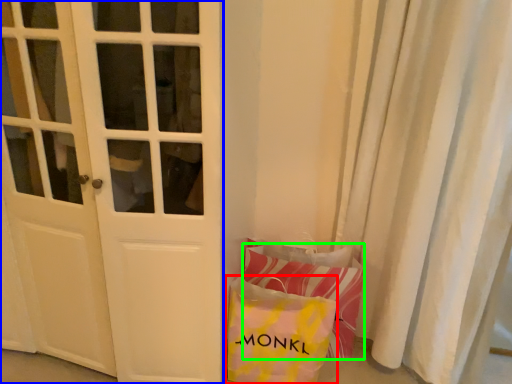
Question: Which object is the closest to the pouch (highlighted by a red box)? Choose among these: door (highlighted by a blue box) or pillow (highlighted by a green box).

Choices:
 (A) door
 (B) pillow

Answer: (B)